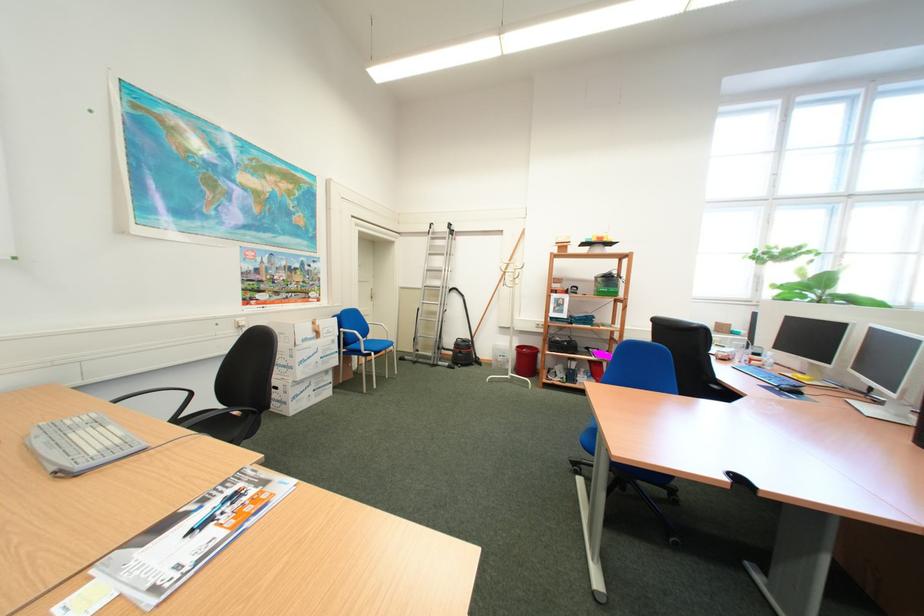
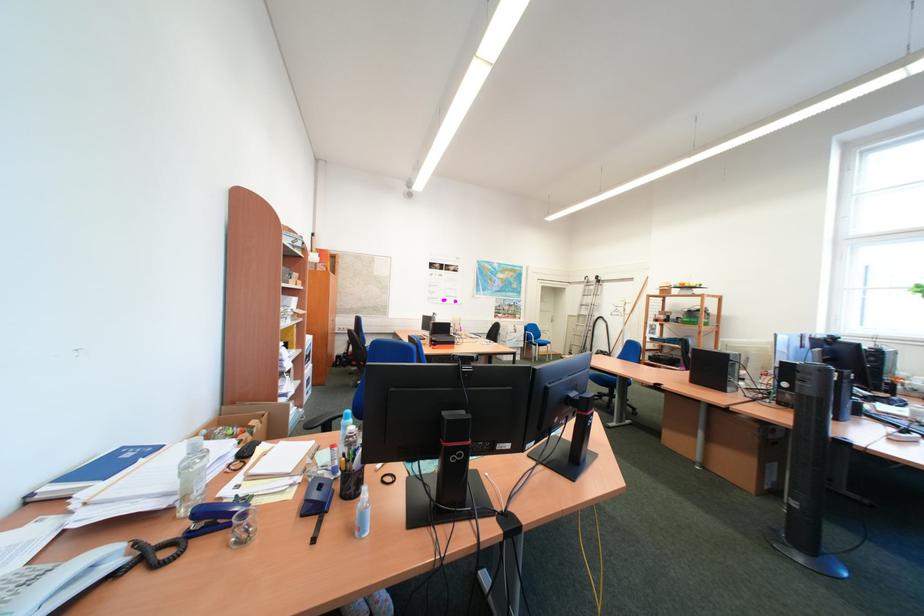
In the second image, find the point that corresponds to [438,241] in the first image.

(596, 288)